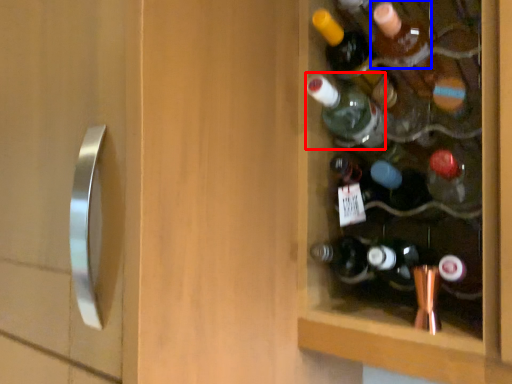
Question: Which object is closer to the camera taking this photo, bottle (highlighted by a red box) or bottle (highlighted by a blue box)?

Choices:
 (A) bottle
 (B) bottle

Answer: (B)